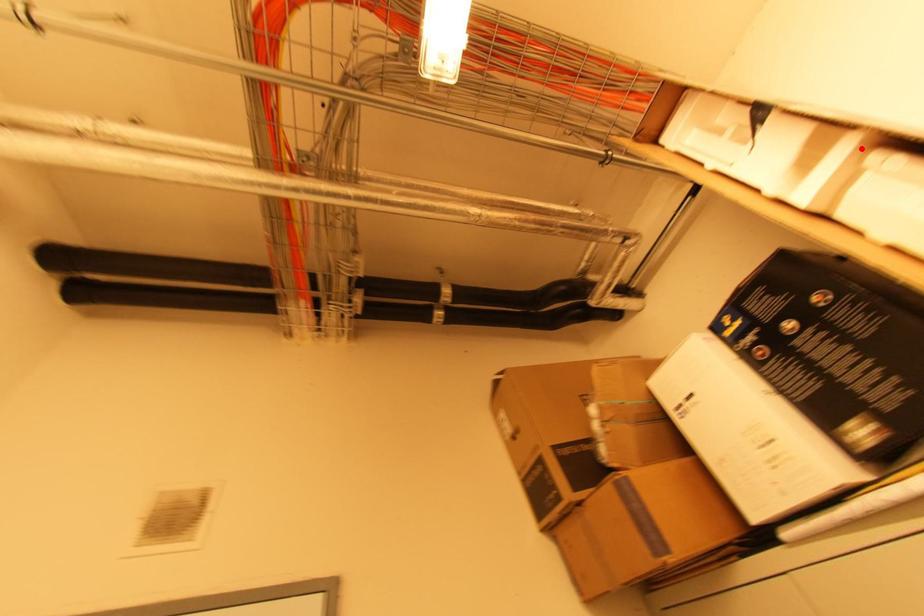
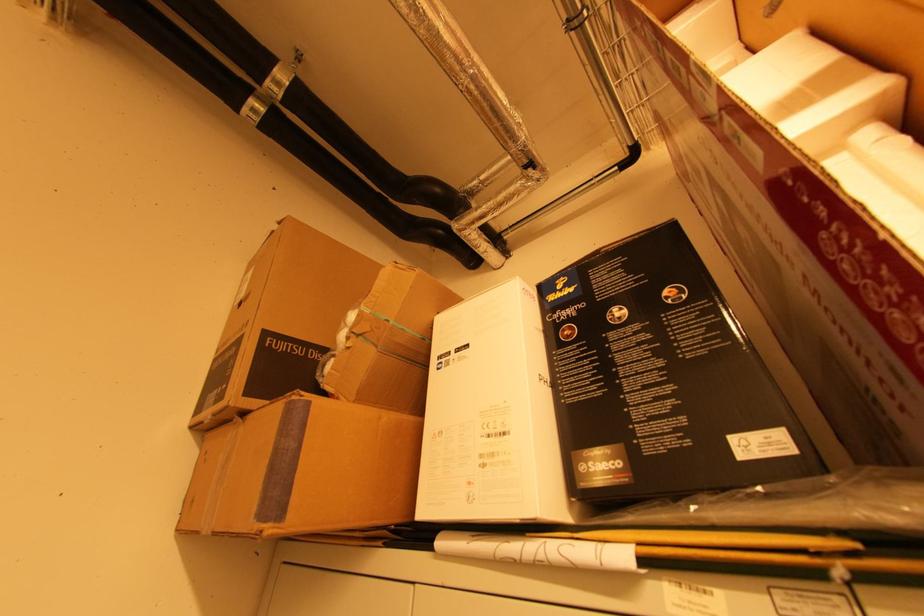
Locate, in the second image, the point that corresponds to the highlighted location in the first image.

(862, 107)